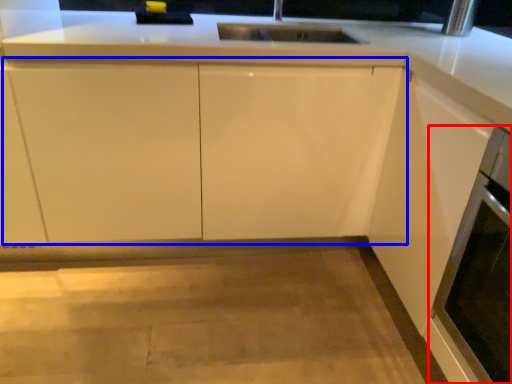
Question: Among these objects, which one is farthest to the camera, oven (highlighted by a red box) or cabinetry (highlighted by a blue box)?

Choices:
 (A) oven
 (B) cabinetry

Answer: (B)